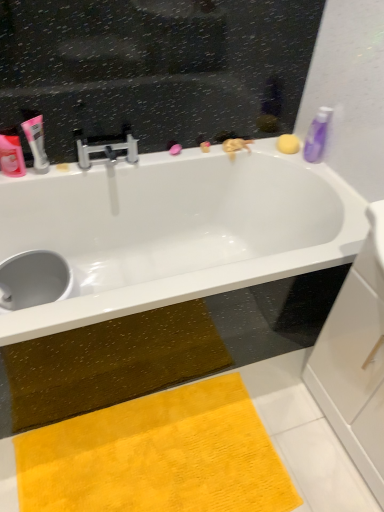
Question: Can you confirm if white glossy bathtub at upper center is bigger than purple glossy bottle at upper right, the third toiletry viewed from the left?

Choices:
 (A) yes
 (B) no

Answer: (A)

Question: Would you say purple glossy bottle at upper right, the 1th toiletry when ordered from right to left, is part of white glossy bathtub at upper center's contents?

Choices:
 (A) yes
 (B) no

Answer: (B)

Question: Does white glossy bathtub at upper center have a greater width compared to purple glossy bottle at upper right, the third toiletry viewed from the left?

Choices:
 (A) yes
 (B) no

Answer: (A)

Question: From the image's perspective, is white glossy bathtub at upper center located above purple glossy bottle at upper right, the 1th toiletry when ordered from right to left?

Choices:
 (A) yes
 (B) no

Answer: (B)

Question: From a real-world perspective, is white glossy bathtub at upper center beneath purple glossy bottle at upper right, the third toiletry viewed from the left?

Choices:
 (A) yes
 (B) no

Answer: (A)

Question: Considering their positions, is purple glossy bottle at upper right, the third toiletry viewed from the left, located in front of or behind matte pink tube at left, which is the 1th toiletry from left to right?

Choices:
 (A) behind
 (B) front

Answer: (A)

Question: From their relative heights in the image, would you say purple glossy bottle at upper right, the third toiletry viewed from the left, is taller or shorter than matte pink tube at left, which ranks as the third toiletry in right-to-left order?

Choices:
 (A) short
 (B) tall

Answer: (B)

Question: From the image's perspective, is purple glossy bottle at upper right, the third toiletry viewed from the left, positioned above or below matte pink tube at left, which ranks as the third toiletry in right-to-left order?

Choices:
 (A) above
 (B) below

Answer: (A)

Question: Considering the relative positions of purple glossy bottle at upper right, the third toiletry viewed from the left, and matte pink tube at left, which ranks as the third toiletry in right-to-left order, in the image provided, is purple glossy bottle at upper right, the third toiletry viewed from the left, to the left or to the right of matte pink tube at left, which ranks as the third toiletry in right-to-left order,?

Choices:
 (A) left
 (B) right

Answer: (B)

Question: In the image, is yellow plush doormat at lower center positioned in front of or behind purple glossy bottle at upper right, the third toiletry viewed from the left?

Choices:
 (A) behind
 (B) front

Answer: (B)

Question: Is yellow plush doormat at lower center to the left or to the right of purple glossy bottle at upper right, the 1th toiletry when ordered from right to left, in the image?

Choices:
 (A) right
 (B) left

Answer: (B)

Question: In terms of width, does yellow plush doormat at lower center look wider or thinner when compared to purple glossy bottle at upper right, the 1th toiletry when ordered from right to left?

Choices:
 (A) wide
 (B) thin

Answer: (A)

Question: From a real-world perspective, is yellow plush doormat at lower center above or below purple glossy bottle at upper right, the 1th toiletry when ordered from right to left?

Choices:
 (A) below
 (B) above

Answer: (A)

Question: Relative to yellow sponge at upper right, is pink matte tube at upper left, which appears as the 2th toiletry when viewed from the right, in front or behind?

Choices:
 (A) front
 (B) behind

Answer: (A)

Question: Is point (31, 130) closer or farther from the camera than point (289, 140)?

Choices:
 (A) closer
 (B) farther

Answer: (A)